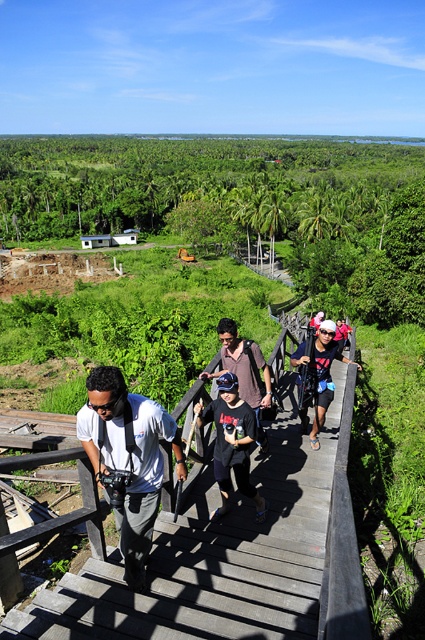
Question: Considering the relative positions of wooden bridge at center and white matte shirt at center in the image provided, where is wooden bridge at center located with respect to white matte shirt at center?

Choices:
 (A) below
 (B) above

Answer: (A)

Question: Is matte black backpack at center to the left of matte black helmet at upper center from the viewer's perspective?

Choices:
 (A) yes
 (B) no

Answer: (A)

Question: Can you confirm if white matte shirt at center is bigger than matte black helmet at upper center?

Choices:
 (A) no
 (B) yes

Answer: (A)

Question: Which of these objects is positioned farthest from the matte black helmet at upper center?

Choices:
 (A) black matte t-shirt at center
 (B) matte black backpack at center
 (C) wooden bridge at center

Answer: (C)

Question: Which object appears closest to the camera in this image?

Choices:
 (A) black matte t-shirt at center
 (B) matte black helmet at center

Answer: (A)

Question: Which object appears farthest from the camera in this image?

Choices:
 (A) wooden bridge at center
 (B) matte black helmet at upper center

Answer: (B)